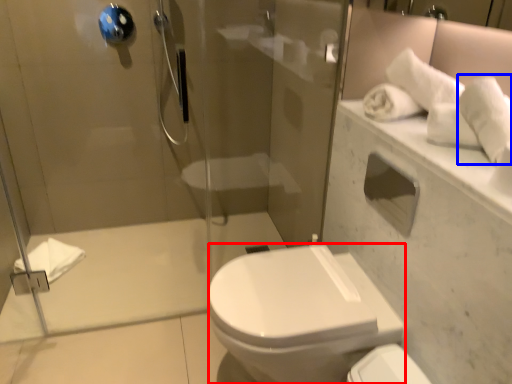
Question: Which point is closer to the camera, bidet (highlighted by a red box) or bath towel (highlighted by a blue box)?

Choices:
 (A) bidet
 (B) bath towel

Answer: (B)